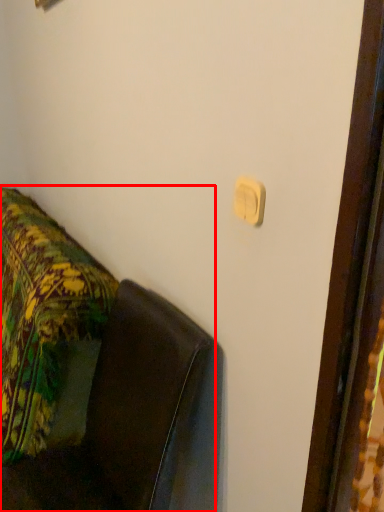
Question: Observing the image, what is the correct spatial positioning of furniture (annotated by the red box) in reference to light switch?

Choices:
 (A) right
 (B) left

Answer: (B)